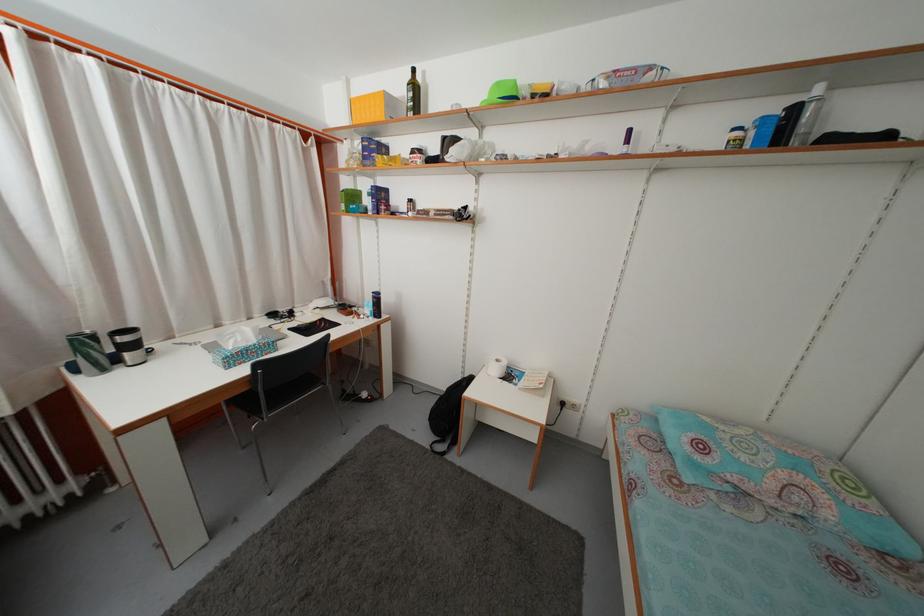
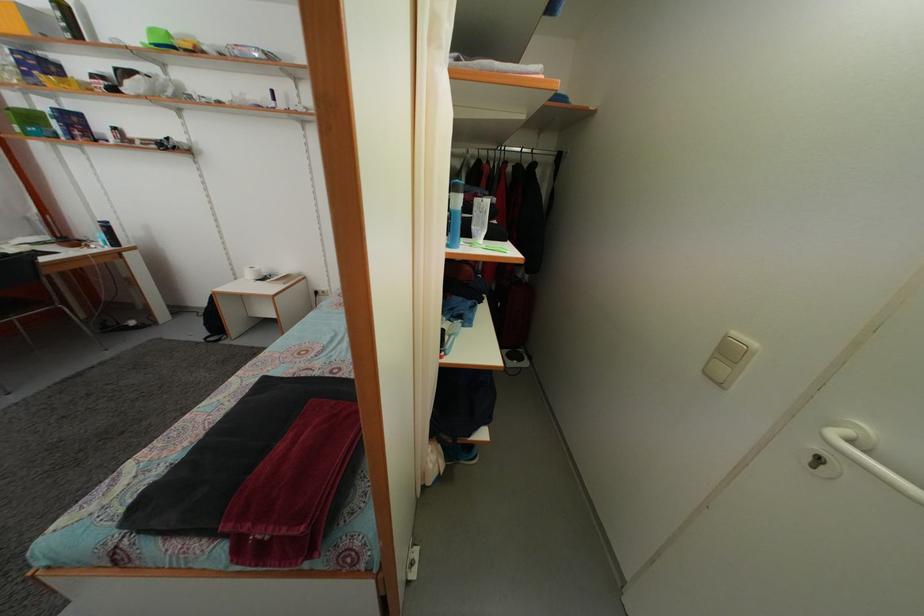
Which direction would the cameraman need to move to produce the second image?

The cameraman walked toward right, backward.